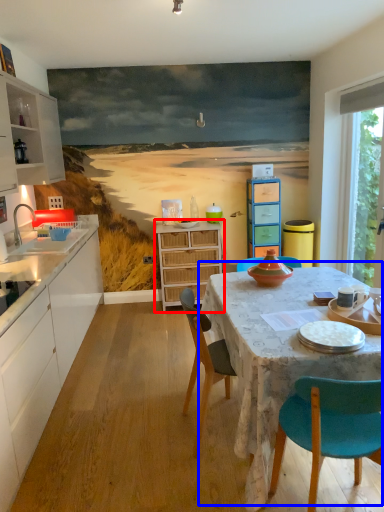
Question: Which object is closer to the camera taking this photo, chest of drawers (highlighted by a red box) or kitchen & dining room table (highlighted by a blue box)?

Choices:
 (A) chest of drawers
 (B) kitchen & dining room table

Answer: (B)